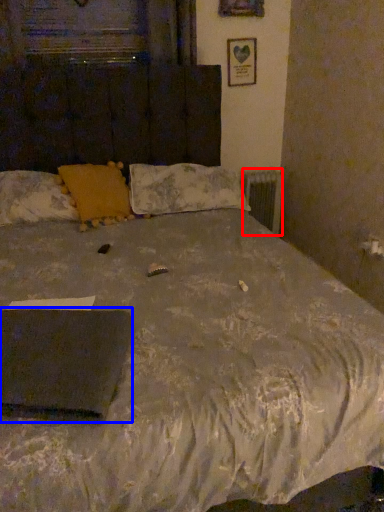
Question: Among these objects, which one is nearest to the camera, radiator (highlighted by a red box) or pad (highlighted by a blue box)?

Choices:
 (A) radiator
 (B) pad

Answer: (B)